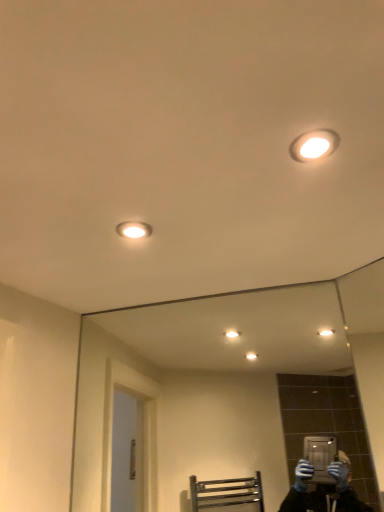
Question: Are clear glass mirror at center and matte white light fixture at upper right, the 2th light fixture from the back, far apart?

Choices:
 (A) no
 (B) yes

Answer: (B)

Question: From the image's perspective, is clear glass mirror at center on matte white light fixture at upper right, which is the second light fixture from bottom to top?

Choices:
 (A) yes
 (B) no

Answer: (B)

Question: Could you tell me if clear glass mirror at center is facing matte white light fixture at upper right, the 2th light fixture from the back?

Choices:
 (A) yes
 (B) no

Answer: (A)

Question: Considering the relative sizes of clear glass mirror at center and matte white light fixture at upper right, which is counted as the 1th light fixture, starting from the right, in the image provided, is clear glass mirror at center taller than matte white light fixture at upper right, which is counted as the 1th light fixture, starting from the right,?

Choices:
 (A) no
 (B) yes

Answer: (B)

Question: From a real-world perspective, is clear glass mirror at center located beneath matte white light fixture at upper right, the 2th light fixture from the back?

Choices:
 (A) no
 (B) yes

Answer: (B)

Question: Is point (140, 222) closer or farther from the camera than point (241, 353)?

Choices:
 (A) farther
 (B) closer

Answer: (B)

Question: Considering the positions of matte white light fixture at upper left, which ranks as the 2th light fixture in right-to-left order, and clear glass mirror at center in the image, is matte white light fixture at upper left, which ranks as the 2th light fixture in right-to-left order, wider or thinner than clear glass mirror at center?

Choices:
 (A) wide
 (B) thin

Answer: (A)

Question: In terms of height, does matte white light fixture at upper left, the first light fixture viewed from the back, look taller or shorter compared to clear glass mirror at center?

Choices:
 (A) tall
 (B) short

Answer: (B)

Question: From the image's perspective, relative to clear glass mirror at center, is matte white light fixture at upper left, which ranks as the 2th light fixture in right-to-left order, above or below?

Choices:
 (A) above
 (B) below

Answer: (A)

Question: Is matte white light fixture at upper right, positioned as the first light fixture in top-to-bottom order, in front of or behind clear glass mirror at center in the image?

Choices:
 (A) front
 (B) behind

Answer: (A)

Question: In terms of height, does matte white light fixture at upper right, positioned as the first light fixture in top-to-bottom order, look taller or shorter compared to clear glass mirror at center?

Choices:
 (A) short
 (B) tall

Answer: (A)

Question: From a real-world perspective, is matte white light fixture at upper right, which is the 2th light fixture in left-to-right order, physically located above or below clear glass mirror at center?

Choices:
 (A) below
 (B) above

Answer: (B)

Question: Is matte white light fixture at upper right, which ranks as the first light fixture in front-to-back order, inside or outside of clear glass mirror at center?

Choices:
 (A) outside
 (B) inside

Answer: (A)

Question: From a real-world perspective, relative to matte white light fixture at upper right, which is counted as the 1th light fixture, starting from the right, is clear glass mirror at center vertically above or below?

Choices:
 (A) below
 (B) above

Answer: (A)

Question: Does point (152, 392) appear closer or farther from the camera than point (301, 144)?

Choices:
 (A) closer
 (B) farther

Answer: (B)